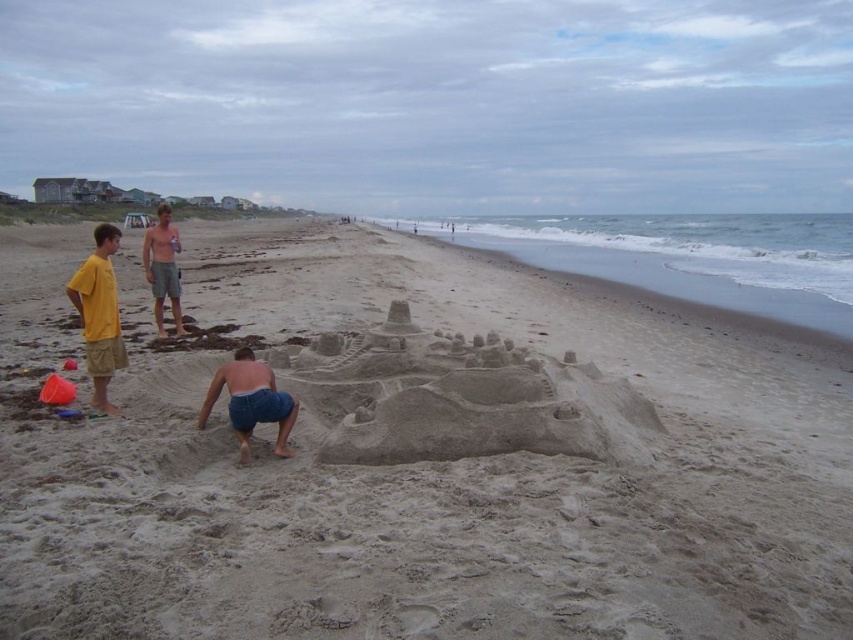
You are standing at point (422,460) on the beach. What is located exactly at your current position?

The smooth sandcastle at center is located at point (422,460).

You are standing on the beach and see two points marked on the sand. The first point is at coordinates point [437,300] and the second is at point [283,396]. If you want to walk from the first point to the second, which direction should you face to move directly towards the second point?

To move directly from point [437,300] to point [283,396], you should face northeast because the second point is located northeast of the first point.

You are a photographer trying to capture a wide shot of the smooth sandcastle at center and the blue denim shorts at center. Since the sandcastle is larger, which object should you focus on first to ensure both are in frame?

The smooth sandcastle at center is larger in size than the blue denim shorts at center, so you should focus on the smooth sandcastle at center first to ensure both are in frame.